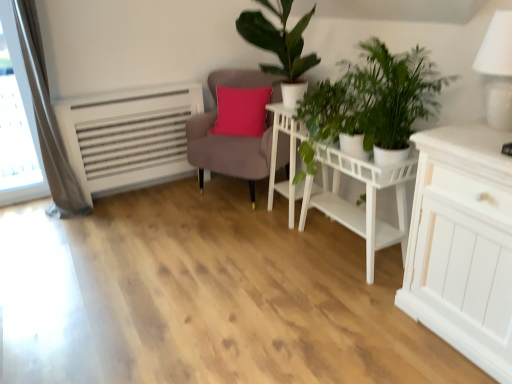
Identify the location of free space in front of gray fabric curtain at left. (26, 227).